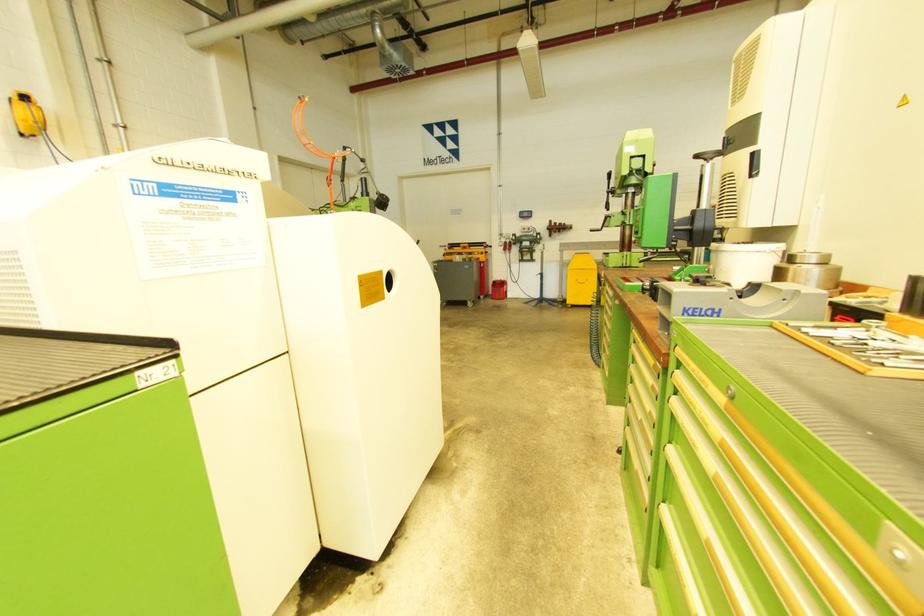
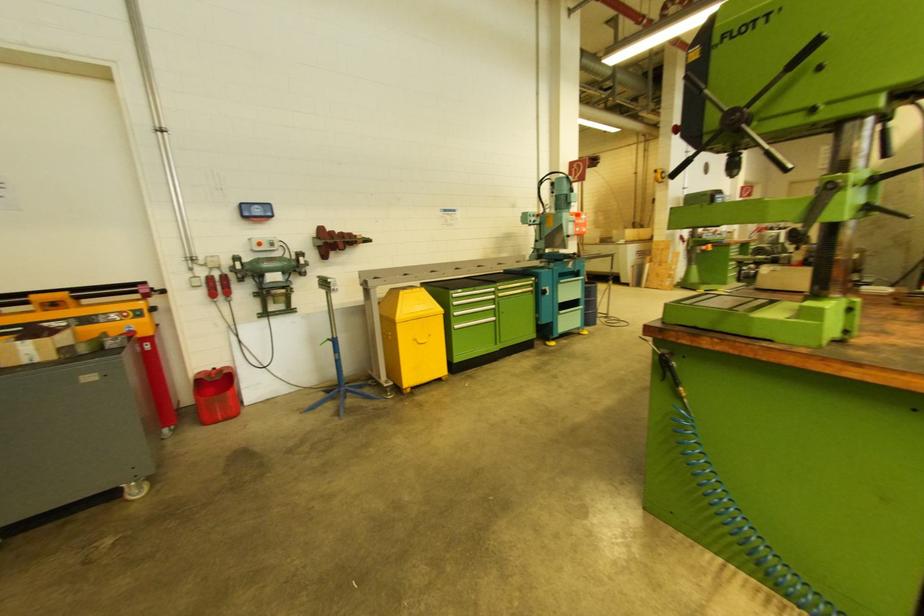
Locate, in the second image, the point that corresponds to point (511, 243) in the first image.

(219, 276)